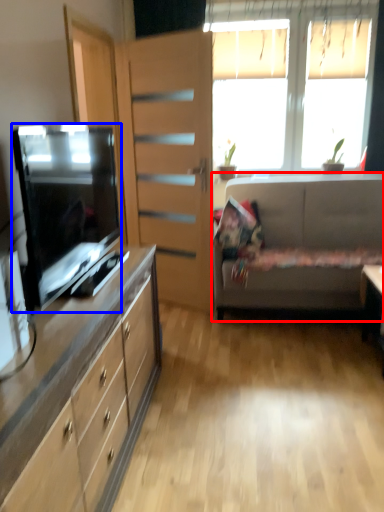
Question: Which object is closer to the camera taking this photo, studio couch (highlighted by a red box) or television (highlighted by a blue box)?

Choices:
 (A) studio couch
 (B) television

Answer: (B)